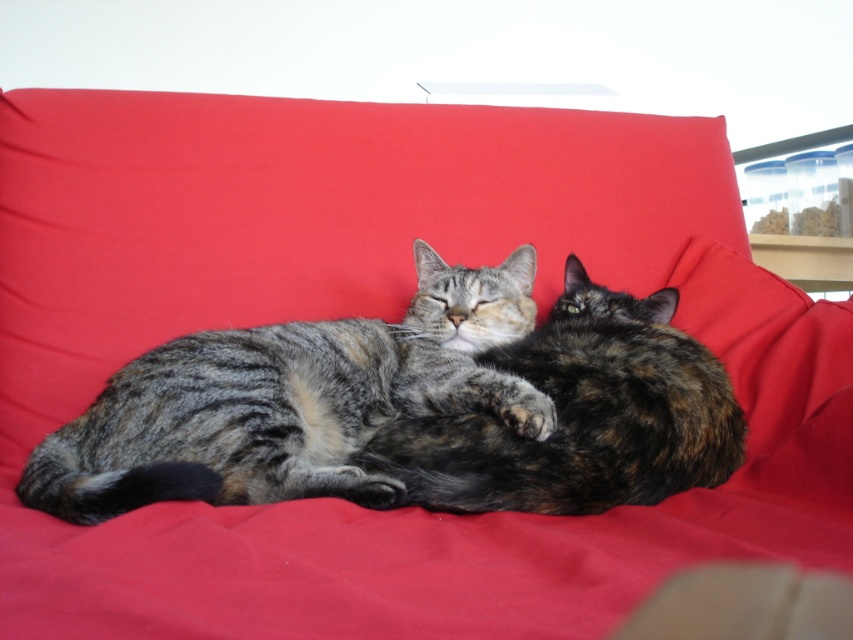
You are a photographer trying to capture both cats in a single shot. Since the gray tabby cat at center is much taller than the tabby fur cat at center, which cat will appear larger in the photo?

The gray tabby cat at center will appear larger in the photo because it is much taller than the tabby fur cat at center.

You are a photographer trying to capture both cats in a single frame. Given that the gray tabby cat at center is sleeping and the tabby fur cat at center is awake, which cat should you focus on first to ensure both are in focus? Please explain your reasoning based on their positions and sizes.

You should focus on the gray tabby cat at center first because it is larger in size than the tabby fur cat at center. By focusing on the larger cat, you can ensure that the smaller cat will also be within the depth of field, keeping both in focus.